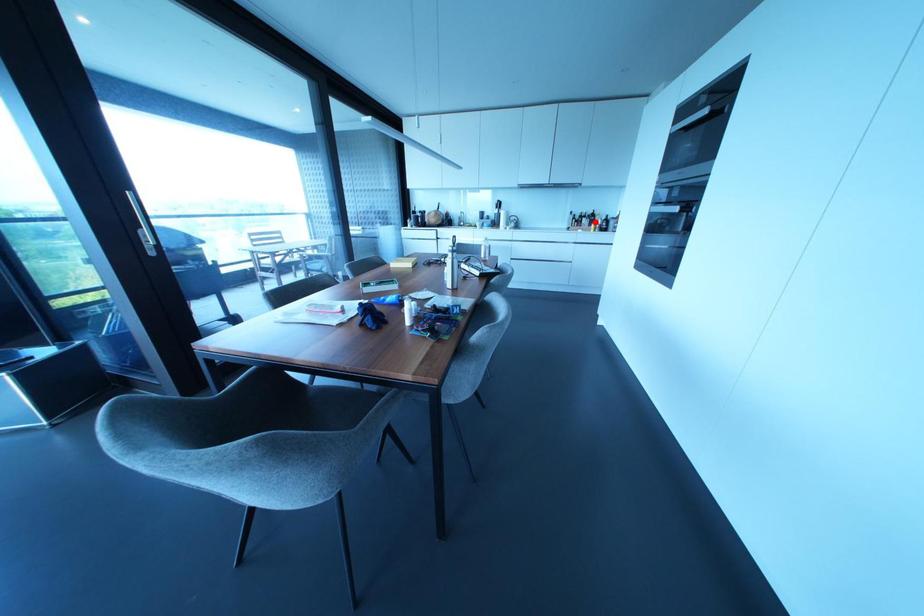
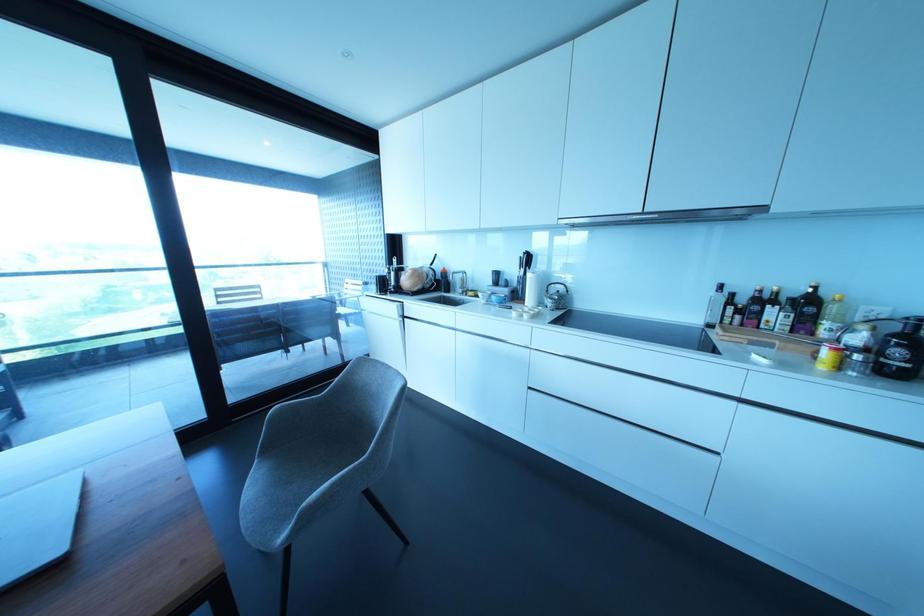
Find the pixel in the second image that matches the highlighted location in the first image.

(825, 323)